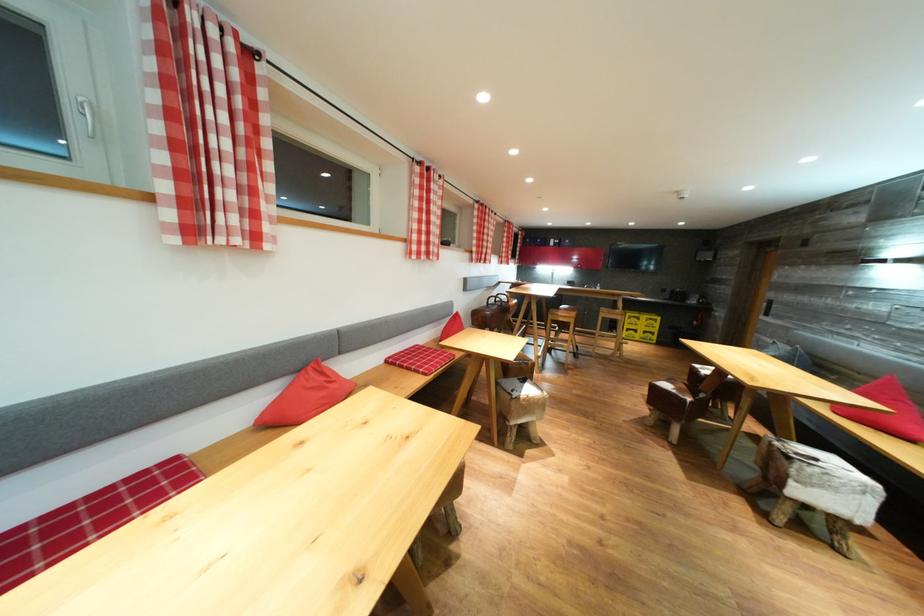
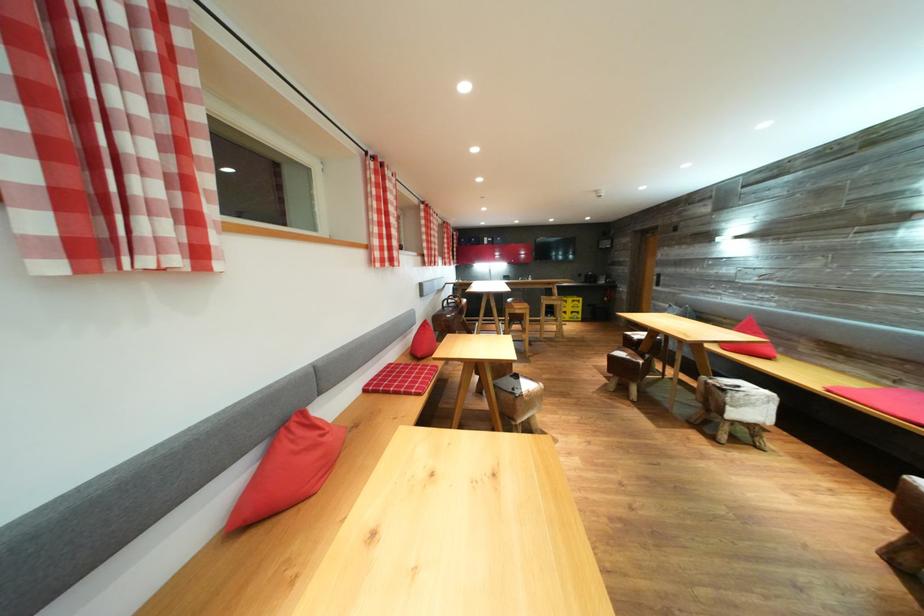
Question: The camera is either moving clockwise (left) or counter-clockwise (right) around the object. The first image is from the beginning of the video and the second image is from the end. Is the camera moving left or right when shooting the video?

Choices:
 (A) Left
 (B) Right

Answer: (A)